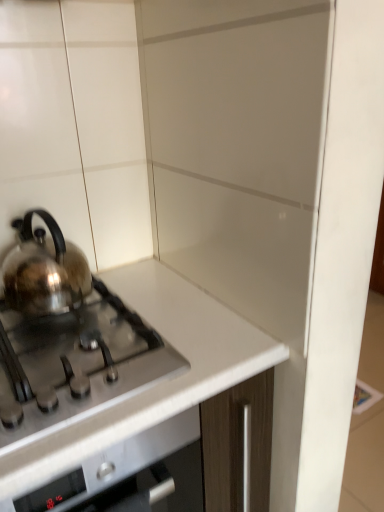
Question: From the image's perspective, is white glossy countertop at center on satin silver gas stove at left?

Choices:
 (A) no
 (B) yes

Answer: (A)

Question: Does white glossy countertop at center lie in front of satin silver gas stove at left?

Choices:
 (A) yes
 (B) no

Answer: (A)

Question: Is white glossy countertop at center directly adjacent to satin silver gas stove at left?

Choices:
 (A) no
 (B) yes

Answer: (A)

Question: Does white glossy countertop at center lie behind satin silver gas stove at left?

Choices:
 (A) no
 (B) yes

Answer: (A)

Question: Does white glossy countertop at center have a larger size compared to satin silver gas stove at left?

Choices:
 (A) no
 (B) yes

Answer: (B)

Question: In terms of size, does satin silver kettle at left appear bigger or smaller than satin silver gas stove at left?

Choices:
 (A) small
 (B) big

Answer: (A)

Question: Is point (23, 247) positioned closer to the camera than point (16, 340)?

Choices:
 (A) farther
 (B) closer

Answer: (A)

Question: In the image, is satin silver kettle at left positioned in front of or behind satin silver gas stove at left?

Choices:
 (A) behind
 (B) front

Answer: (A)

Question: From their relative heights in the image, would you say satin silver kettle at left is taller or shorter than satin silver gas stove at left?

Choices:
 (A) short
 (B) tall

Answer: (B)

Question: From their relative heights in the image, would you say satin silver kettle at left is taller or shorter than white glossy countertop at center?

Choices:
 (A) tall
 (B) short

Answer: (B)

Question: Is point (41, 304) positioned closer to the camera than point (64, 468)?

Choices:
 (A) closer
 (B) farther

Answer: (B)

Question: Is satin silver kettle at left inside or outside of white glossy countertop at center?

Choices:
 (A) inside
 (B) outside

Answer: (B)

Question: From the image's perspective, is satin silver kettle at left located above or below white glossy countertop at center?

Choices:
 (A) below
 (B) above

Answer: (B)

Question: Is satin silver gas stove at left inside the boundaries of satin silver kettle at left, or outside?

Choices:
 (A) outside
 (B) inside

Answer: (A)

Question: From their relative heights in the image, would you say satin silver gas stove at left is taller or shorter than satin silver kettle at left?

Choices:
 (A) short
 (B) tall

Answer: (A)